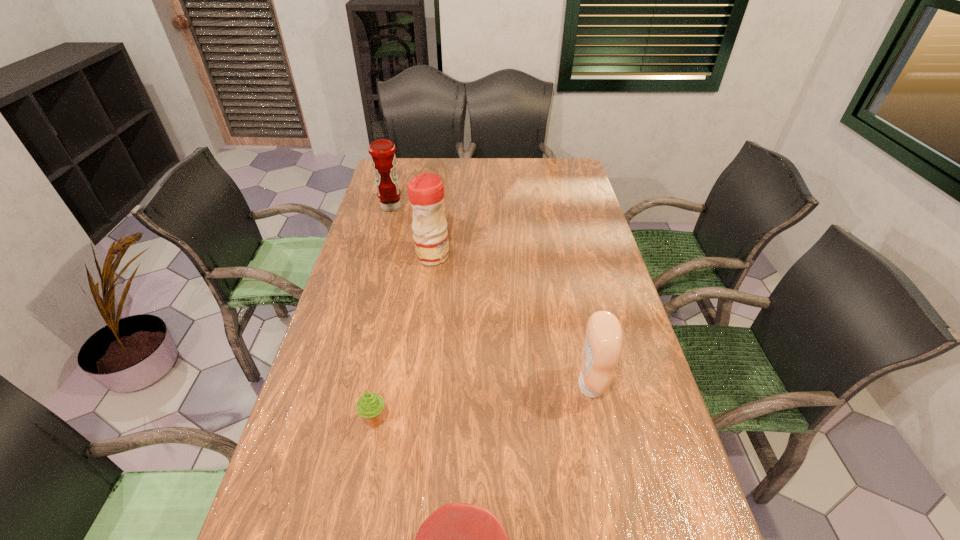
Locate an element on the screen. This screenshot has height=540, width=960. the second closest condiment relative to the shortest object is located at coordinates (425, 191).

Select which condiment is the closest to the leftmost object. Please provide its 2D coordinates. Your answer should be formatted as a tuple, i.e. [(x, y)], where the tuple contains the x and y coordinates of a point satisfying the conditions above.

[(425, 191)]